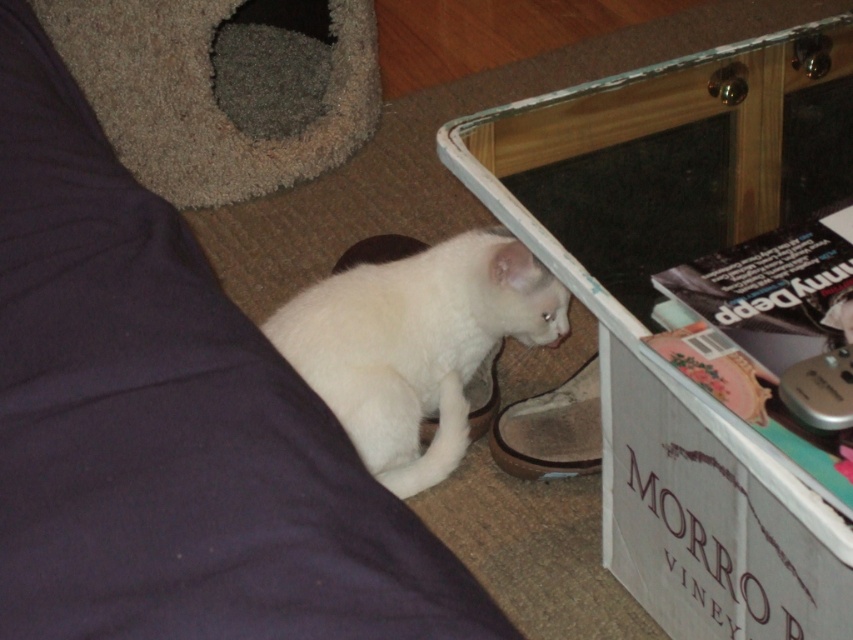
Question: Considering the relative positions of white cardboard box at lower right and white fluffy cat at lower center in the image provided, where is white cardboard box at lower right located with respect to white fluffy cat at lower center?

Choices:
 (A) below
 (B) above

Answer: (A)

Question: Among these objects, which one is farthest from the camera?

Choices:
 (A) white fluffy cat at lower center
 (B) transparent glass table at lower right
 (C) white cardboard box at lower right

Answer: (A)

Question: Which point is farther to the camera?

Choices:
 (A) white fluffy cat at lower center
 (B) transparent glass table at lower right
 (C) white cardboard box at lower right

Answer: (A)

Question: Can you confirm if white cardboard box at lower right is thinner than white fluffy cat at lower center?

Choices:
 (A) yes
 (B) no

Answer: (A)

Question: Which of the following is the farthest from the observer?

Choices:
 (A) white fluffy cat at lower center
 (B) transparent glass table at lower right

Answer: (A)

Question: Does transparent glass table at lower right appear under white fluffy cat at lower center?

Choices:
 (A) no
 (B) yes

Answer: (A)